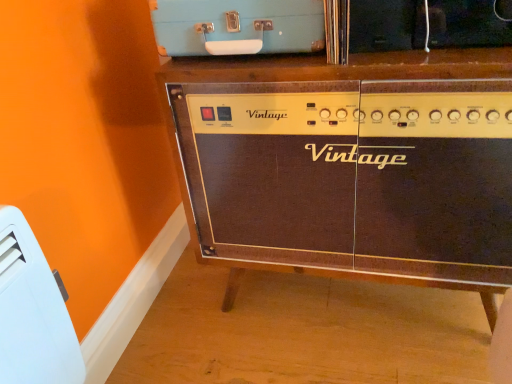
This screenshot has height=384, width=512. Identify the location of white plastic heater at lower left, placed as the 1th appliance when sorted from bottom to top. (32, 312).

What is the approximate height of brown wood cabinet at center?

28.32 inches.

Locate an element on the screen. The width and height of the screenshot is (512, 384). light blue plastic suitcase at upper center, arranged as the first appliance when viewed from the right is located at coordinates (237, 26).

Is white plastic heater at lower left, the 2th appliance positioned from the right, spatially inside brown wood cabinet at center, or outside of it?

white plastic heater at lower left, the 2th appliance positioned from the right, exists outside the volume of brown wood cabinet at center.

Does white plastic heater at lower left, which is the 1th appliance in left-to-right order, have a larger size compared to brown wood cabinet at center?

Actually, white plastic heater at lower left, which is the 1th appliance in left-to-right order, might be smaller than brown wood cabinet at center.

Looking at this image, who is more distant, white plastic heater at lower left, which is the 1th appliance in left-to-right order, or brown wood cabinet at center?

brown wood cabinet at center is behind.

Is white plastic heater at lower left, which is the 1th appliance in left-to-right order, aimed at brown wood cabinet at center?

No, white plastic heater at lower left, which is the 1th appliance in left-to-right order, is not facing towards brown wood cabinet at center.

How distant is brown wood cabinet at center from white plastic heater at lower left, placed as the 1th appliance when sorted from bottom to top?

They are 21.51 inches apart.

Does point (394, 86) lie behind point (34, 311)?

Yes, point (394, 86) is farther from viewer.

Considering the relative sizes of brown wood cabinet at center and white plastic heater at lower left, the 2th appliance positioned from the right, in the image provided, is brown wood cabinet at center taller than white plastic heater at lower left, the 2th appliance positioned from the right,?

Yes, brown wood cabinet at center is taller than white plastic heater at lower left, the 2th appliance positioned from the right.

In the image, is brown wood cabinet at center positioned in front of or behind white plastic heater at lower left, which is counted as the 2th appliance, starting from the top?

brown wood cabinet at center is positioned farther from the viewer than white plastic heater at lower left, which is counted as the 2th appliance, starting from the top.

Is white plastic heater at lower left, placed as the 1th appliance when sorted from bottom to top, outside of light blue plastic suitcase at upper center, which is counted as the 1th appliance, starting from the top?

white plastic heater at lower left, placed as the 1th appliance when sorted from bottom to top, is positioned outside light blue plastic suitcase at upper center, which is counted as the 1th appliance, starting from the top.

Which of these two, white plastic heater at lower left, placed as the 1th appliance when sorted from bottom to top, or light blue plastic suitcase at upper center, which ranks as the second appliance in bottom-to-top order, is smaller?

Smaller between the two is white plastic heater at lower left, placed as the 1th appliance when sorted from bottom to top.

In the scene shown: Which of these two, white plastic heater at lower left, which is counted as the 2th appliance, starting from the top, or light blue plastic suitcase at upper center, positioned as the 2th appliance in left-to-right order, is thinner?

Thinner between the two is white plastic heater at lower left, which is counted as the 2th appliance, starting from the top.

Looking at this image, from the image's perspective, is brown wood cabinet at center on light blue plastic suitcase at upper center, arranged as the first appliance when viewed from the right?

No, from the image's perspective, brown wood cabinet at center is not above light blue plastic suitcase at upper center, arranged as the first appliance when viewed from the right.

Is brown wood cabinet at center in front of or behind light blue plastic suitcase at upper center, arranged as the first appliance when viewed from the right, in the image?

In the image, brown wood cabinet at center appears in front of light blue plastic suitcase at upper center, arranged as the first appliance when viewed from the right.

Would you say brown wood cabinet at center is a long distance from light blue plastic suitcase at upper center, arranged as the first appliance when viewed from the right?

brown wood cabinet at center is actually quite close to light blue plastic suitcase at upper center, arranged as the first appliance when viewed from the right.

Which object is positioned more to the right, brown wood cabinet at center or light blue plastic suitcase at upper center, which ranks as the second appliance in bottom-to-top order?

brown wood cabinet at center.

Considering the sizes of objects light blue plastic suitcase at upper center, which is counted as the 1th appliance, starting from the top, and white plastic heater at lower left, which is counted as the 2th appliance, starting from the top, in the image provided, who is bigger, light blue plastic suitcase at upper center, which is counted as the 1th appliance, starting from the top, or white plastic heater at lower left, which is counted as the 2th appliance, starting from the top,?

With larger size is light blue plastic suitcase at upper center, which is counted as the 1th appliance, starting from the top.

From the image's perspective, is light blue plastic suitcase at upper center, positioned as the 2th appliance in left-to-right order, located beneath white plastic heater at lower left, which is counted as the 2th appliance, starting from the top?

Actually, light blue plastic suitcase at upper center, positioned as the 2th appliance in left-to-right order, appears above white plastic heater at lower left, which is counted as the 2th appliance, starting from the top, in the image.

Does light blue plastic suitcase at upper center, which is counted as the 1th appliance, starting from the top, appear on the left side of white plastic heater at lower left, placed as the 1th appliance when sorted from bottom to top?

In fact, light blue plastic suitcase at upper center, which is counted as the 1th appliance, starting from the top, is to the right of white plastic heater at lower left, placed as the 1th appliance when sorted from bottom to top.

Is light blue plastic suitcase at upper center, arranged as the first appliance when viewed from the right, not near white plastic heater at lower left, the 2th appliance positioned from the right?

No.

Is light blue plastic suitcase at upper center, arranged as the first appliance when viewed from the right, facing towards brown wood cabinet at center?

No, light blue plastic suitcase at upper center, arranged as the first appliance when viewed from the right, is not oriented towards brown wood cabinet at center.

Considering the relative sizes of light blue plastic suitcase at upper center, positioned as the 2th appliance in left-to-right order, and brown wood cabinet at center in the image provided, is light blue plastic suitcase at upper center, positioned as the 2th appliance in left-to-right order, wider than brown wood cabinet at center?

In fact, light blue plastic suitcase at upper center, positioned as the 2th appliance in left-to-right order, might be narrower than brown wood cabinet at center.

How much distance is there between light blue plastic suitcase at upper center, which ranks as the second appliance in bottom-to-top order, and brown wood cabinet at center?

light blue plastic suitcase at upper center, which ranks as the second appliance in bottom-to-top order, is 9.83 inches away from brown wood cabinet at center.

Considering the sizes of objects light blue plastic suitcase at upper center, which is counted as the 1th appliance, starting from the top, and brown wood cabinet at center in the image provided, who is shorter, light blue plastic suitcase at upper center, which is counted as the 1th appliance, starting from the top, or brown wood cabinet at center?

light blue plastic suitcase at upper center, which is counted as the 1th appliance, starting from the top, is shorter.

Where is `appliance lying in front of the brown wood cabinet at center`? appliance lying in front of the brown wood cabinet at center is located at coordinates (32, 312).

Identify the location of furniture below the white plastic heater at lower left, which is counted as the 2th appliance, starting from the top (from a real-world perspective). The height and width of the screenshot is (384, 512). (343, 171).

Estimate the real-world distances between objects in this image. Which object is closer to white plastic heater at lower left, the 2th appliance positioned from the right, light blue plastic suitcase at upper center, which ranks as the second appliance in bottom-to-top order, or brown wood cabinet at center?

light blue plastic suitcase at upper center, which ranks as the second appliance in bottom-to-top order, is positioned closer to the anchor white plastic heater at lower left, the 2th appliance positioned from the right.

Which object lies further to the anchor point white plastic heater at lower left, placed as the 1th appliance when sorted from bottom to top, brown wood cabinet at center or light blue plastic suitcase at upper center, which is counted as the 1th appliance, starting from the top?

brown wood cabinet at center is positioned further to the anchor white plastic heater at lower left, placed as the 1th appliance when sorted from bottom to top.

From the image, which object appears to be farther from light blue plastic suitcase at upper center, which ranks as the second appliance in bottom-to-top order, white plastic heater at lower left, the 2th appliance positioned from the right, or brown wood cabinet at center?

Among the two, white plastic heater at lower left, the 2th appliance positioned from the right, is located further to light blue plastic suitcase at upper center, which ranks as the second appliance in bottom-to-top order.

Which object lies nearer to the anchor point brown wood cabinet at center, white plastic heater at lower left, the 2th appliance positioned from the right, or light blue plastic suitcase at upper center, positioned as the 2th appliance in left-to-right order?

The object closer to brown wood cabinet at center is light blue plastic suitcase at upper center, positioned as the 2th appliance in left-to-right order.

From the image, which object appears to be nearer to light blue plastic suitcase at upper center, which is counted as the 1th appliance, starting from the top, brown wood cabinet at center or white plastic heater at lower left, the 2th appliance positioned from the right?

brown wood cabinet at center lies closer to light blue plastic suitcase at upper center, which is counted as the 1th appliance, starting from the top, than the other object.

Considering their positions, is light blue plastic suitcase at upper center, arranged as the first appliance when viewed from the right, positioned closer to brown wood cabinet at center than white plastic heater at lower left, which is counted as the 2th appliance, starting from the top?

Based on the image, light blue plastic suitcase at upper center, arranged as the first appliance when viewed from the right, appears to be nearer to brown wood cabinet at center.

The image size is (512, 384). What are the coordinates of `appliance situated between white plastic heater at lower left, which is counted as the 2th appliance, starting from the top, and brown wood cabinet at center from left to right` in the screenshot? It's located at (237, 26).